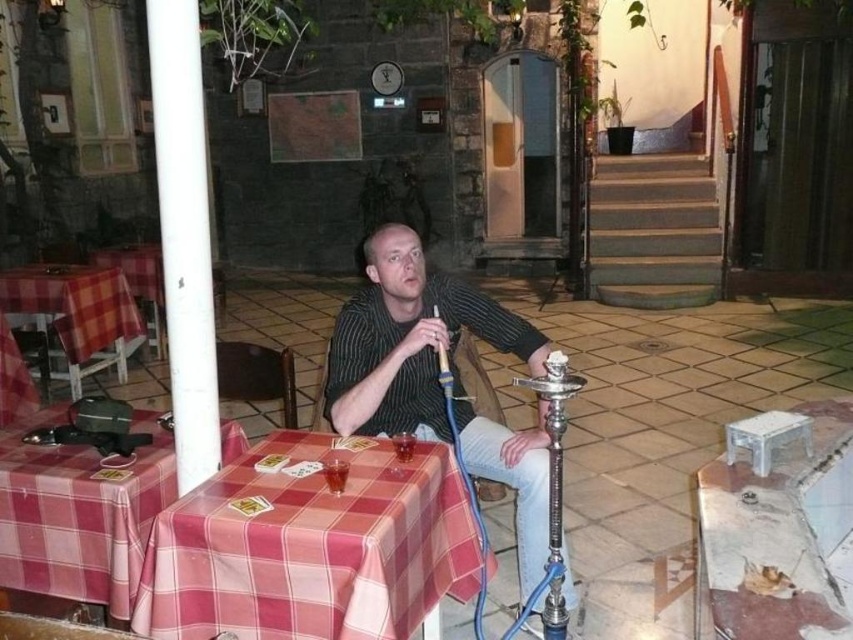
What are the coordinates of the striped fabric shirt at center?

The striped fabric shirt at center is located at coordinates point (409,340).

You are standing at the point labeled point (560, 364) and want to walk towards the point labeled point (405, 396). Which direction should you move relative to your current position?

You should move forward because point (405, 396) is behind point (560, 364), meaning it is in the direction you are facing when standing at point (560, 364).

You are a customer at the outdoor seating area and want to place your phone on the plaid fabric table at lower left. However, there is a striped fabric shirt at center in the way. Can you move the shirt to the left to make space?

The striped fabric shirt at center is positioned on the right side of the plaid fabric table at lower left. To make space, you can move the striped fabric shirt at center to the left side of the plaid fabric table at lower left.